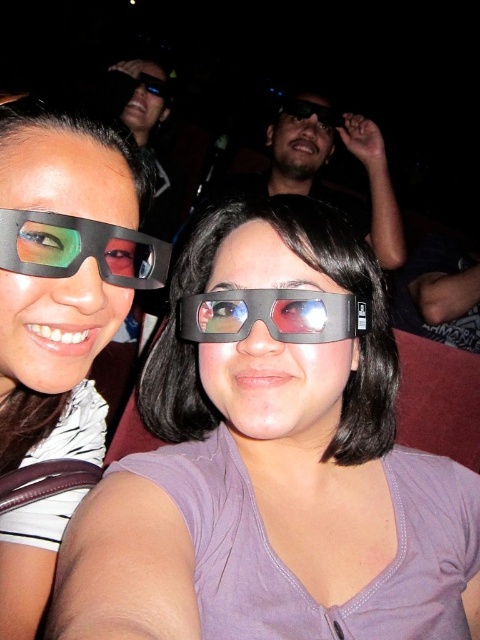
Looking at this image, can you confirm if matte black 3d glasses at center is positioned below matte black glasses at upper center?

Indeed, matte black 3d glasses at center is positioned under matte black glasses at upper center.

Is matte black 3d glasses at center further to the viewer compared to matte black glasses at upper center?

No, it is not.

Describe the element at coordinates (80, 248) in the screenshot. I see `matte black 3d glasses at center` at that location.

Find the location of a particular element. This screenshot has height=640, width=480. matte black 3d glasses at center is located at coordinates (80, 248).

Who is shorter, matte black 3d glasses at center or matte black goggles at center?

Standing shorter between the two is matte black goggles at center.

Is the position of matte black 3d glasses at center less distant than that of matte black goggles at center?

Yes, it is in front of matte black goggles at center.

Which is behind, point (117, 256) or point (262, 300)?

The point (262, 300) is more distant.

Locate an element on the screen. matte black 3d glasses at center is located at coordinates 80,248.

Can you confirm if matte black glasses at left is shorter than matte black 3d glasses at center?

In fact, matte black glasses at left may be taller than matte black 3d glasses at center.

Where is `matte black glasses at left`? The width and height of the screenshot is (480, 640). matte black glasses at left is located at coordinates (58, 324).